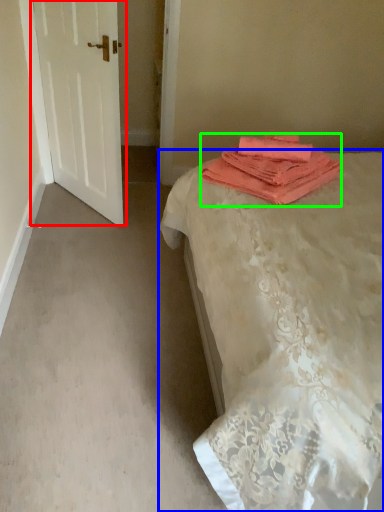
Question: Estimate the real-world distances between objects in this image. Which object is farther from door (highlighted by a red box), bed (highlighted by a blue box) or towel (highlighted by a green box)?

Choices:
 (A) bed
 (B) towel

Answer: (A)